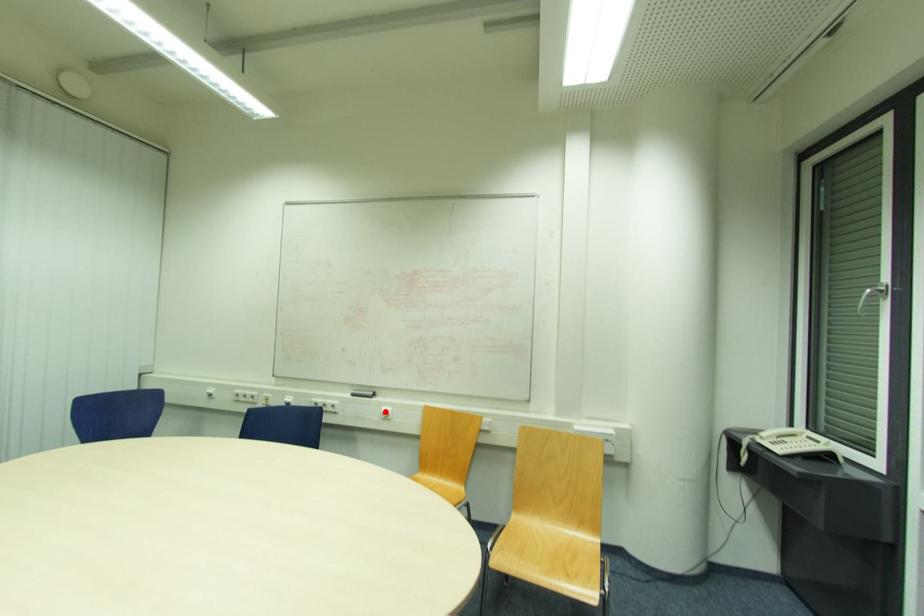
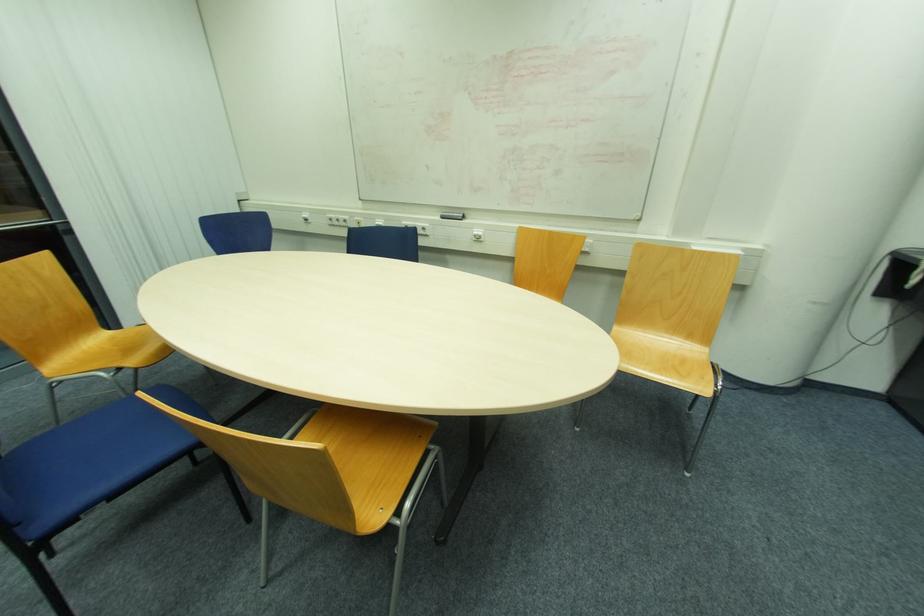
Question: A red point is marked in image1. In image2, is the corresponding 3D point closer to the camera or farther? Reply with the corresponding letter.

Choices:
 (A) The corresponding 3D point is closer.
 (B) The corresponding 3D point is farther.

Answer: (A)